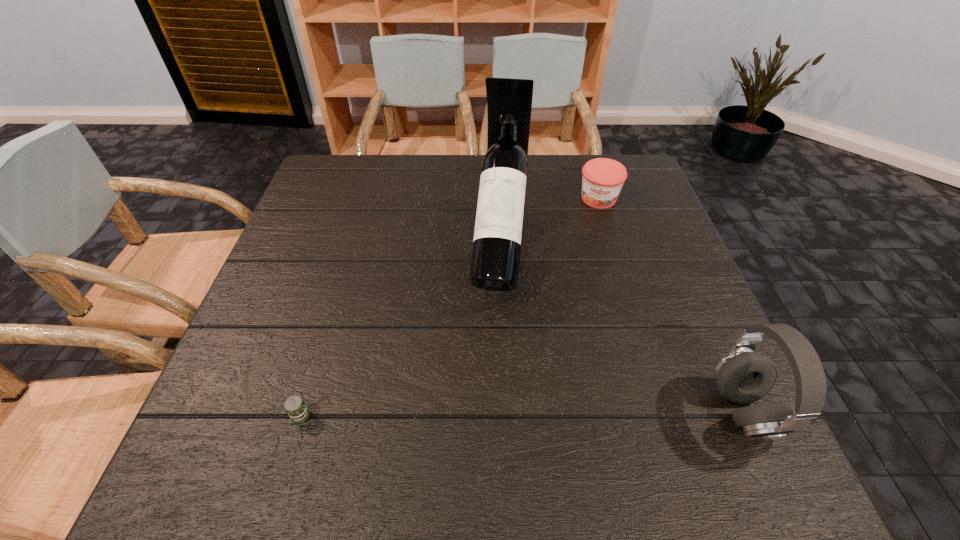
Locate an element on the screen. This screenshot has width=960, height=540. vacant area located 0.170m on the front label of the second object from right to left is located at coordinates (591, 253).

Find the location of a particular element. vacant position located 0.390m on the front label of the second object from right to left is located at coordinates (584, 322).

Find the location of a particular element. The width and height of the screenshot is (960, 540). vacant point located 0.200m on the stand of the second object from left to right is located at coordinates (489, 401).

Find the location of a particular element. The width and height of the screenshot is (960, 540). vacant region located on the stand of the second object from left to right is located at coordinates (487, 416).

At what (x,y) coordinates should I click in order to perform the action: click on vacant position located 0.240m on the stand of the second object from left to right. Please return your answer as a coordinate pair (x, y). Looking at the image, I should click on (486, 422).

Identify the location of jam that is positioned at the far edge. (602, 180).

The height and width of the screenshot is (540, 960). Find the location of `wine bottle present at the far edge`. wine bottle present at the far edge is located at coordinates (495, 262).

What are the coordinates of `beer can located in the near edge section of the desktop` in the screenshot? It's located at (295, 407).

What are the coordinates of `headset that is at the near edge` in the screenshot? It's located at (743, 376).

The height and width of the screenshot is (540, 960). In order to click on object at the left edge in this screenshot , I will do `click(295, 407)`.